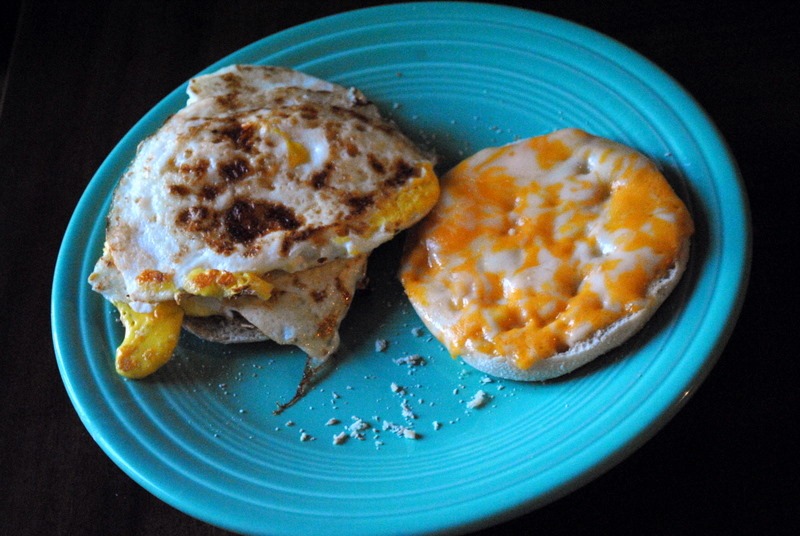
The width and height of the screenshot is (800, 536). I want to click on teal plate, so click(x=520, y=492).